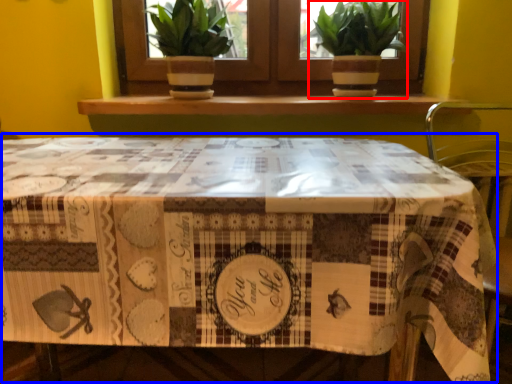
Question: Which point is closer to the camera, houseplant (highlighted by a red box) or table (highlighted by a blue box)?

Choices:
 (A) houseplant
 (B) table

Answer: (B)